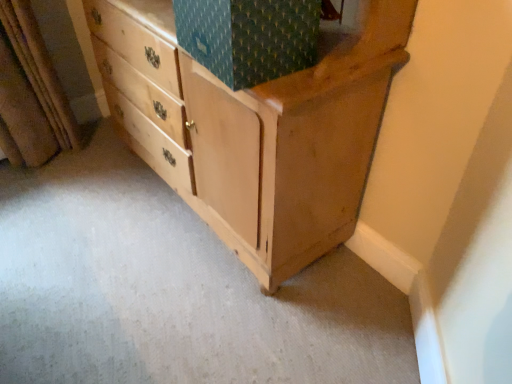
You are a GUI agent. You are given a task and a screenshot of the screen. Output one action in this format:
    pyautogui.click(x=<x>, y=<y>)
    Task: Click on the light brown wood chest of drawers at lower left
    The image size is (512, 384).
    Given the screenshot: What is the action you would take?
    [x=257, y=131]

This screenshot has width=512, height=384. What do you see at coordinates (257, 131) in the screenshot? I see `light brown wood chest of drawers at lower left` at bounding box center [257, 131].

This screenshot has width=512, height=384. I want to click on light brown wood chest of drawers at lower left, so click(x=257, y=131).